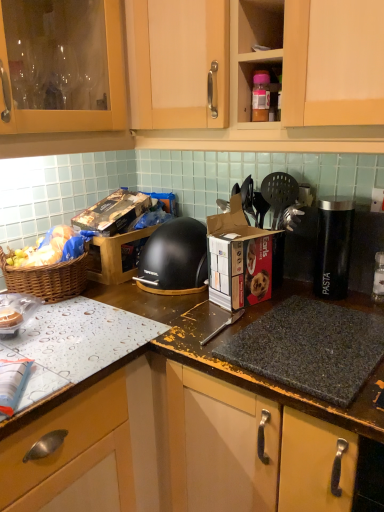
Question: In terms of size, does woven brown picnic basket at left appear bigger or smaller than black cardboard box at center, marked as the first cardboard box in a back-to-front arrangement?

Choices:
 (A) small
 (B) big

Answer: (A)

Question: Is woven brown picnic basket at left taller or shorter than black cardboard box at center, marked as the first cardboard box in a back-to-front arrangement?

Choices:
 (A) short
 (B) tall

Answer: (B)

Question: Which object is positioned farthest from the granite gray gas stove at center?

Choices:
 (A) black plastic canister at right
 (B) granite at center
 (C) woven brown picnic basket at left
 (D) black cardboard box at center, which appears as the 1th cardboard box when viewed from the left
 (E) black matte food processor at center

Answer: (C)

Question: Estimate the real-world distances between objects in this image. Which object is farther from the black cardboard box at center, which appears as the 1th cardboard box when viewed from the left?

Choices:
 (A) black matte food processor at center
 (B) brown woven basket at left
 (C) matte wood cabinet at upper center
 (D) black plastic spatula at upper right
 (E) granite gray gas stove at center

Answer: (E)